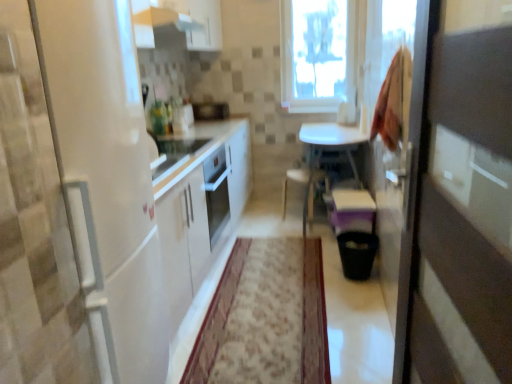
The image size is (512, 384). Find the location of `free area in between wooden chair at center and carpet with floral pattern at center`. free area in between wooden chair at center and carpet with floral pattern at center is located at coordinates (300, 233).